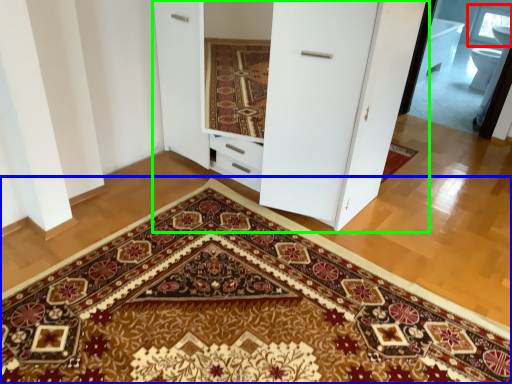
Question: Estimate the real-world distances between objects in this image. Which object is closer to window (highlighted by a red box), doormat (highlighted by a blue box) or dresser (highlighted by a green box)?

Choices:
 (A) doormat
 (B) dresser

Answer: (B)